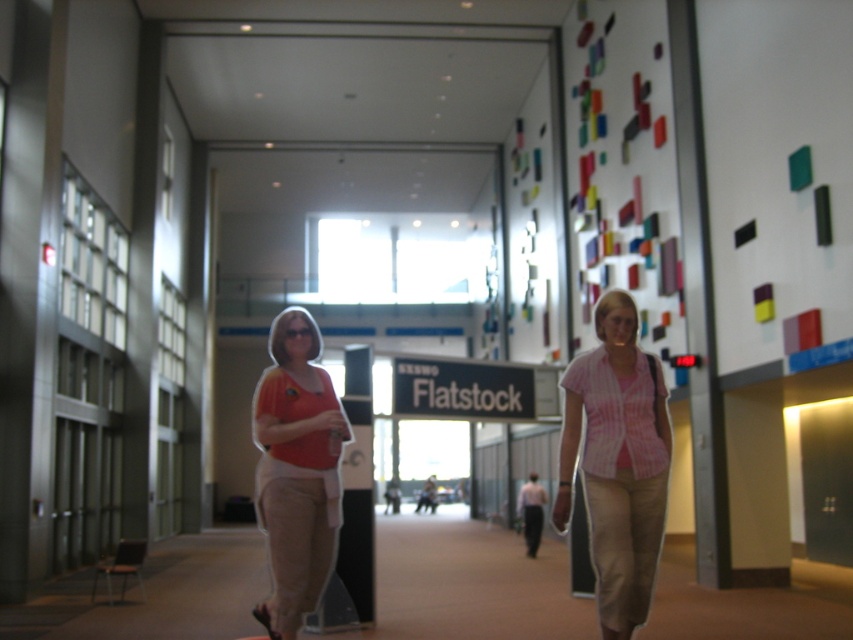
You are a photographer standing in the hallway and want to capture both the pink striped shirt at center and the matte orange shirt at center in a single frame. Which person should you focus on first to ensure both are in the shot?

The pink striped shirt at center is taller than the matte orange shirt at center, so you should focus on the taller individual wearing the pink striped shirt at center first to ensure both are in the shot.

You are standing in the hallway and see two people wearing a pink striped shirt at center and a matte orange shirt at center. Which person is standing to the right of the other?

The pink striped shirt at center is positioned on the right side of matte orange shirt at center, so the person wearing the pink striped shirt at center is to the right of the person in the matte orange shirt at center.